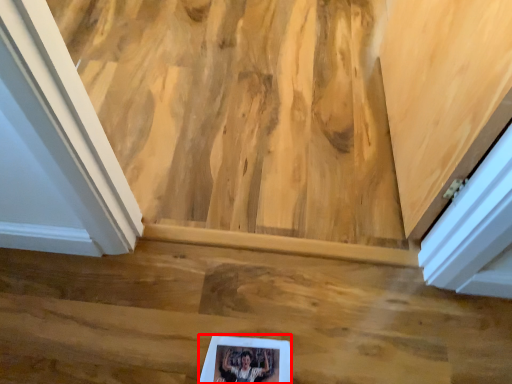
Question: From the image's perspective, where is picture frame (annotated by the red box) located in relation to stairwell in the image?

Choices:
 (A) below
 (B) above

Answer: (A)